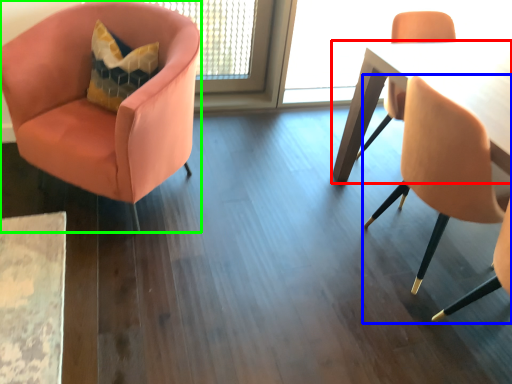
Question: Estimate the real-world distances between objects in this image. Which object is closer to table (highlighted by a red box), chair (highlighted by a blue box) or chair (highlighted by a green box)?

Choices:
 (A) chair
 (B) chair

Answer: (A)